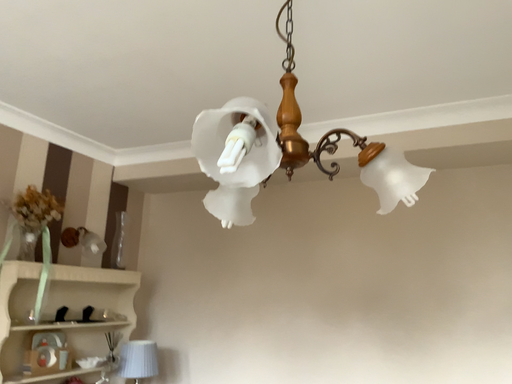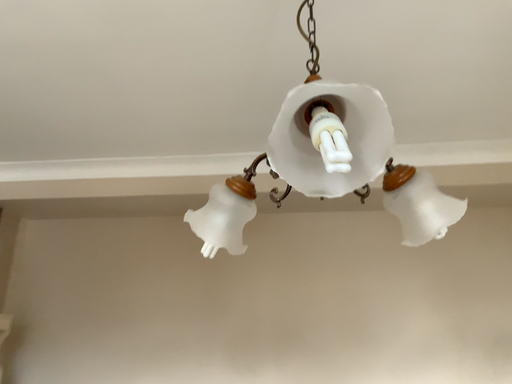
Question: How did the camera likely rotate when shooting the video?

Choices:
 (A) rotated left
 (B) rotated right

Answer: (B)